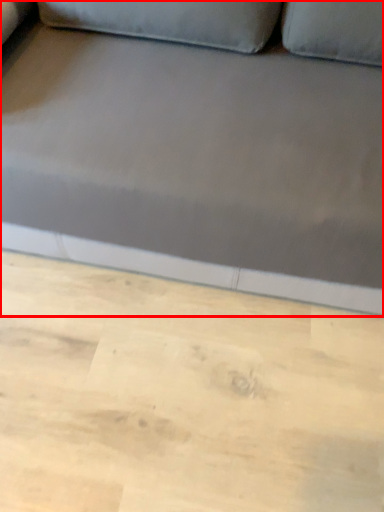
Question: From the image's perspective, what is the correct spatial relationship of studio couch (annotated by the red box) in relation to plywood?

Choices:
 (A) above
 (B) below

Answer: (A)